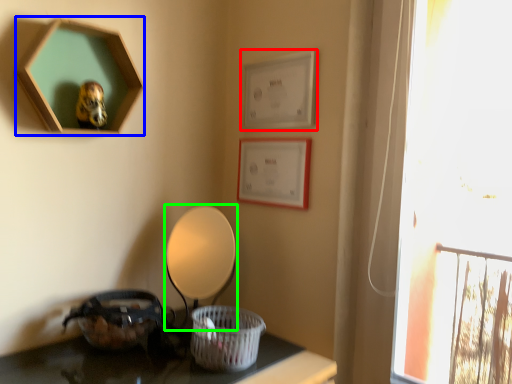
Question: Which object is the farthest from picture frame (highlighted by a red box)? Choose among these: picture frame (highlighted by a blue box) or table lamp (highlighted by a green box).

Choices:
 (A) picture frame
 (B) table lamp

Answer: (A)